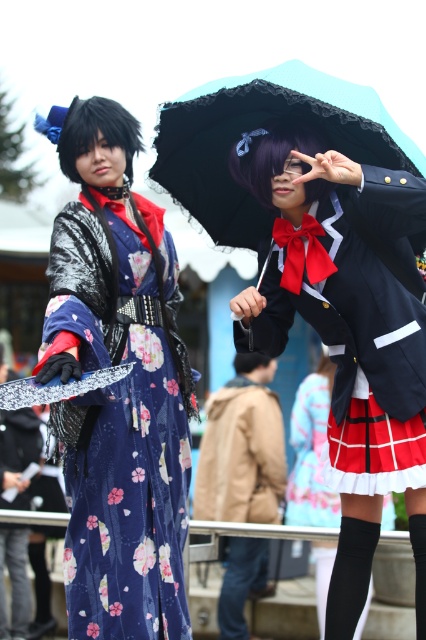
Question: Which of the following is the closest to the observer?

Choices:
 (A) black lace umbrella at upper center
 (B) floral silk kimono at center

Answer: (A)

Question: Which point is farther to the camera?

Choices:
 (A) black lace umbrella at upper center
 (B) floral silk kimono at center

Answer: (B)

Question: Is floral silk kimono at center to the right of black lace umbrella at upper center from the viewer's perspective?

Choices:
 (A) yes
 (B) no

Answer: (B)

Question: Can you confirm if floral silk kimono at center is positioned to the right of black lace umbrella at upper center?

Choices:
 (A) no
 (B) yes

Answer: (A)

Question: Is matte black umbrella at upper center closer to the viewer compared to black lace umbrella at upper center?

Choices:
 (A) no
 (B) yes

Answer: (A)

Question: Which point is farther to the camera?

Choices:
 (A) matte black umbrella at upper center
 (B) floral silk kimono at center

Answer: (B)